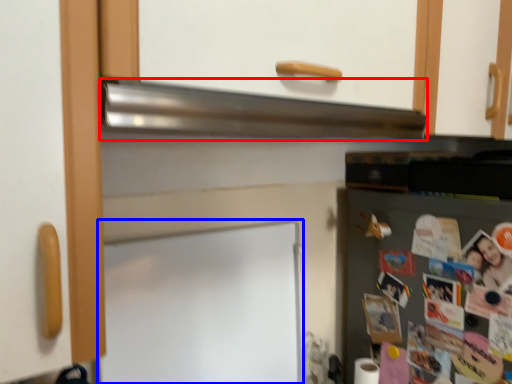
Question: Which of the following is the closest to the observer, exhaust hood (highlighted by a red box) or bulletin board (highlighted by a blue box)?

Choices:
 (A) exhaust hood
 (B) bulletin board

Answer: (A)